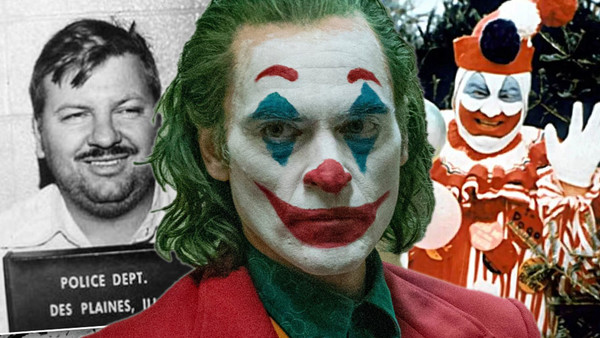
Image resolution: width=600 pixels, height=338 pixels. I want to click on gray wall, so click(178, 18).